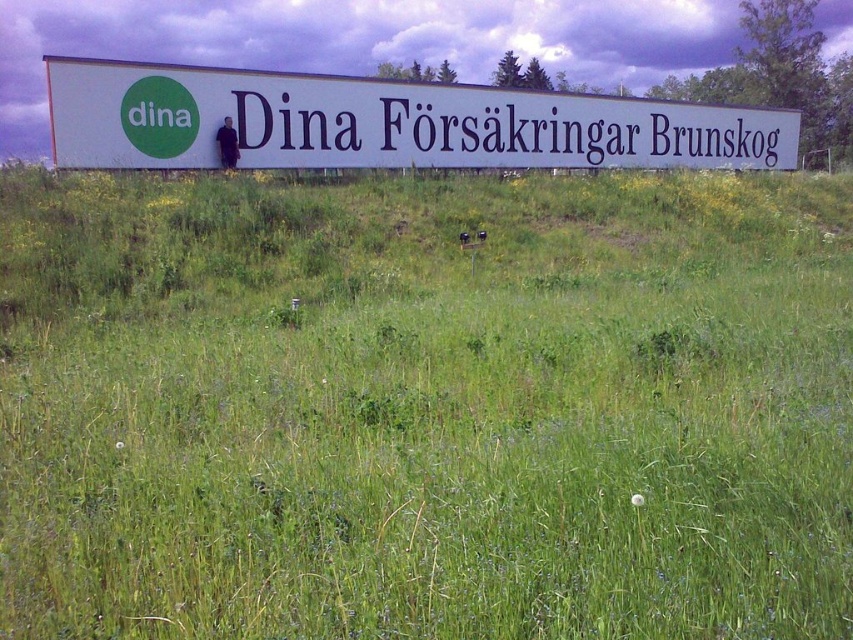
Which is behind, point (132, 614) or point (793, 147)?

Positioned behind is point (793, 147).

Does green grass at center have a lesser width compared to white matte sign at center?

Correct, green grass at center's width is less than white matte sign at center's.

Is point (387, 490) positioned in front of point (483, 112)?

Yes, point (387, 490) is closer to viewer.

At what (x,y) coordinates should I click in order to perform the action: click on green grass at center. Please return your answer as a coordinate pair (x, y). Looking at the image, I should click on click(425, 406).

Who is shorter, green grass at center or white plastic sign at center?

With less height is white plastic sign at center.

Is point (361, 552) less distant than point (479, 243)?

Yes.

The height and width of the screenshot is (640, 853). I want to click on green grass at center, so click(425, 406).

From the picture: How much distance is there between white matte sign at center and white plastic sign at center?

white matte sign at center is 6.84 meters from white plastic sign at center.

Is point (47, 92) positioned behind point (473, 257)?

Yes, point (47, 92) is farther from viewer.

The width and height of the screenshot is (853, 640). I want to click on white matte sign at center, so pyautogui.click(x=386, y=124).